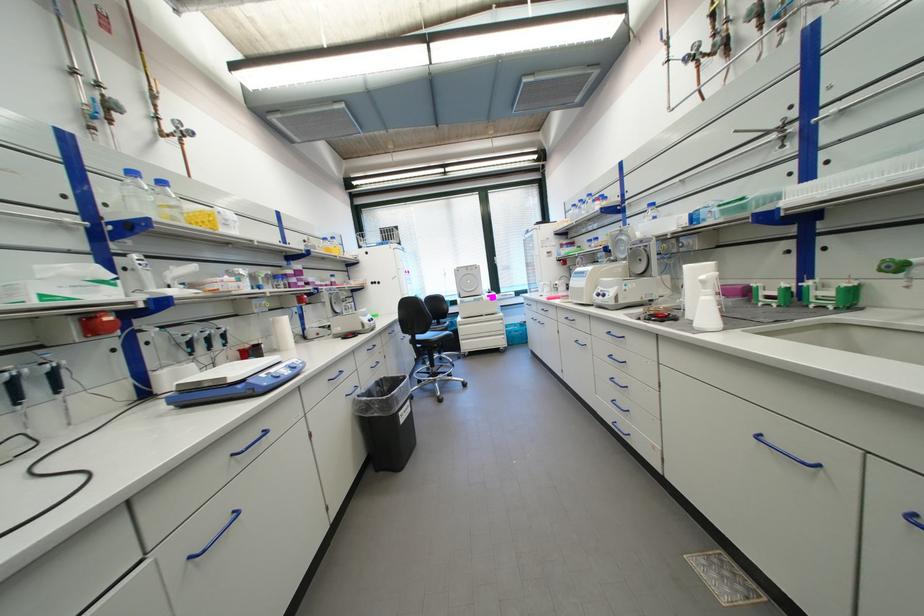
Describe the element at coordinates (468, 281) in the screenshot. I see `a white centrifuge lid` at that location.